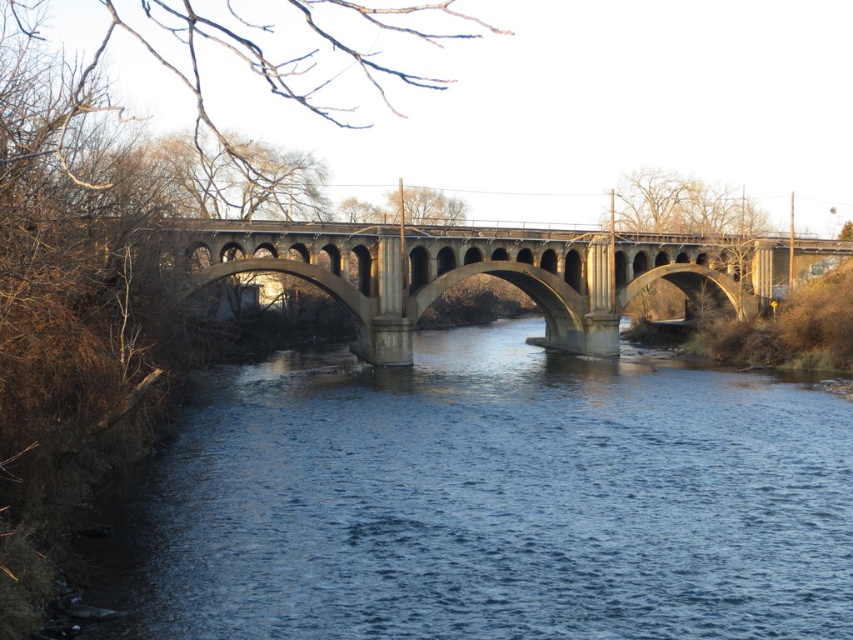
Question: Can you confirm if blue water at center is wider than concrete bridge at center?

Choices:
 (A) no
 (B) yes

Answer: (A)

Question: Is blue water at center to the right of concrete bridge at center from the viewer's perspective?

Choices:
 (A) no
 (B) yes

Answer: (A)

Question: Is blue water at center smaller than concrete bridge at center?

Choices:
 (A) yes
 (B) no

Answer: (A)